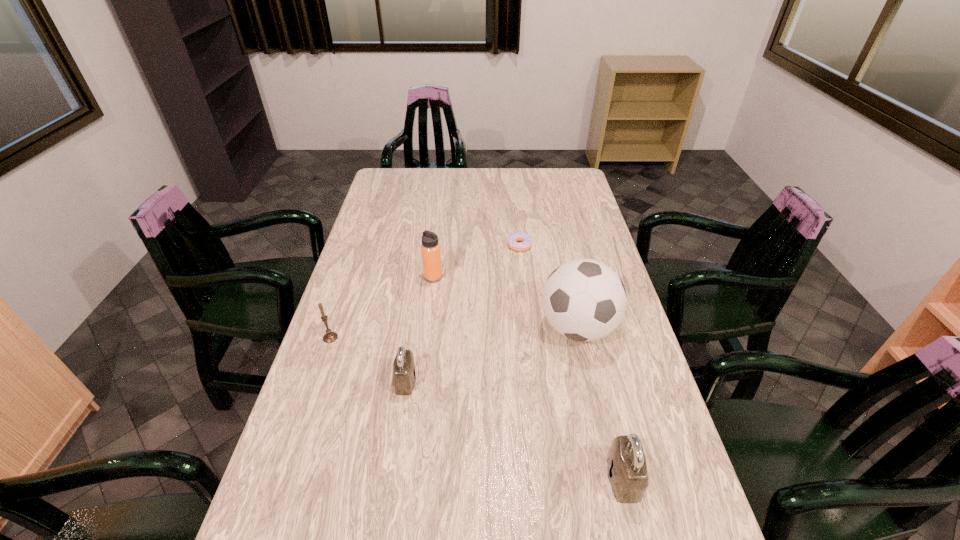
Identify the location of free space between the leftmost object and the second farthest object. Image resolution: width=960 pixels, height=540 pixels. (382, 308).

Where is `free area in between the tallest object and the candle`? free area in between the tallest object and the candle is located at coordinates (454, 333).

Find the location of `empty space between the shorter padlock and the nearer padlock`. empty space between the shorter padlock and the nearer padlock is located at coordinates (515, 430).

The image size is (960, 540). Identify the location of empty location between the shorter padlock and the doughnut. (463, 313).

This screenshot has height=540, width=960. I want to click on object that is the fifth closest to the doughnut, so click(x=626, y=462).

In order to click on object that is the fifth closest to the tallest object in this screenshot , I will do `click(329, 337)`.

Identify the location of free space that satisfies the following two spatial constraints: 1. on the front side of the second tallest object; 2. at the front of the fifth farthest object near the keyhole. (420, 381).